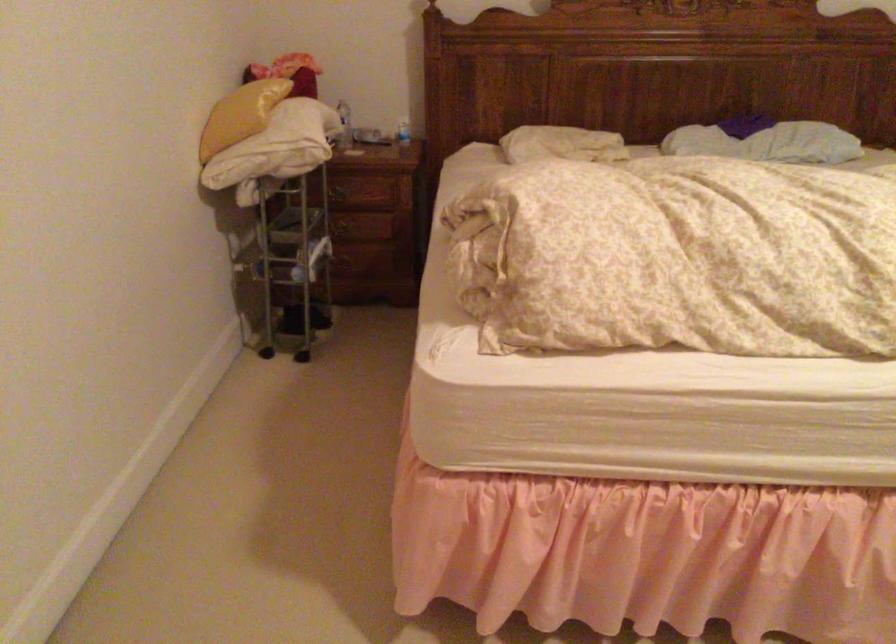
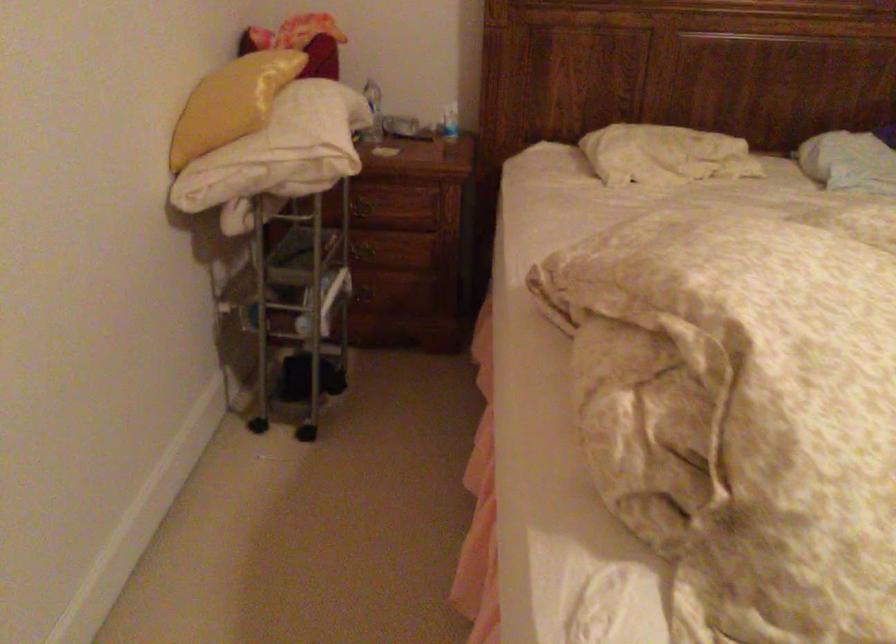
Question: What movement of the cameraman would produce the second image?

Choices:
 (A) Left
 (B) Right
 (C) Forward
 (D) Backward

Answer: (C)